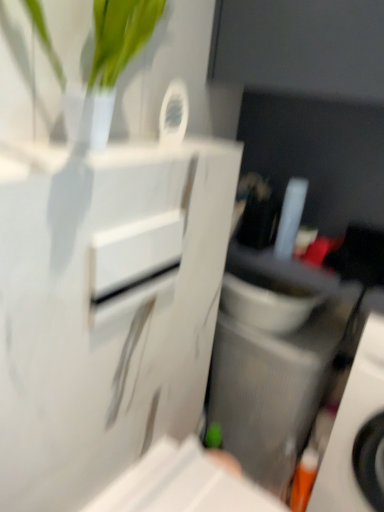
What are the coordinates of `gray textured speaker at lower right` in the screenshot? It's located at (270, 391).

You are a GUI agent. You are given a task and a screenshot of the screen. Output one action in this format:
    pyautogui.click(x=<x>, y=<y>)
    Task: Click on the orange plastic toothbrush at lower right
    The height and width of the screenshot is (512, 384).
    Given the screenshot: What is the action you would take?
    pyautogui.click(x=357, y=434)

Locate an element on the screen. white glossy drawer at center is located at coordinates (134, 254).

From the image's perspective, who appears lower, gray textured speaker at lower right or orange plastic toothbrush at lower right?

From the image's view, orange plastic toothbrush at lower right is below.

Is gray textured speaker at lower right wider than orange plastic toothbrush at lower right?

No.

Are gray textured speaker at lower right and orange plastic toothbrush at lower right beside each other?

No, gray textured speaker at lower right is not touching orange plastic toothbrush at lower right.

Can you tell me how much white glossy drawer at center and orange plastic toothbrush at lower right differ in facing direction?

white glossy drawer at center and orange plastic toothbrush at lower right are facing 91.4 degrees away from each other.

Identify the location of home appliance located behind the white glossy drawer at center. The height and width of the screenshot is (512, 384). (357, 434).

In the scene shown: Considering the relative positions of white glossy drawer at center and orange plastic toothbrush at lower right in the image provided, is white glossy drawer at center behind orange plastic toothbrush at lower right?

No, the depth of white glossy drawer at center is less than that of orange plastic toothbrush at lower right.

From the image's perspective, who appears lower, white glossy drawer at center or gray textured speaker at lower right?

From the image's view, gray textured speaker at lower right is below.

Is point (171, 253) closer to camera compared to point (226, 449)?

Yes, point (171, 253) is in front of point (226, 449).

From a real-world perspective, is white glossy drawer at center on top of gray textured speaker at lower right?

Yes, from a real-world perspective, white glossy drawer at center is on top of gray textured speaker at lower right.

Does white glossy drawer at center contain gray textured speaker at lower right?

That's incorrect, gray textured speaker at lower right is not inside white glossy drawer at center.

Find the location of a particular element. appliance lying above the orange plastic toothbrush at lower right (from the image's perspective) is located at coordinates (270, 391).

Is orange plastic toothbrush at lower right to the left or to the right of gray textured speaker at lower right in the image?

orange plastic toothbrush at lower right is to the right of gray textured speaker at lower right.

From the image's perspective, which one is positioned higher, orange plastic toothbrush at lower right or gray textured speaker at lower right?

gray textured speaker at lower right.

Is orange plastic toothbrush at lower right not within gray textured speaker at lower right?

orange plastic toothbrush at lower right lies outside gray textured speaker at lower right's area.

Where is `drawer that is on the left side of orange plastic toothbrush at lower right`? drawer that is on the left side of orange plastic toothbrush at lower right is located at coordinates (134, 254).

Are orange plastic toothbrush at lower right and white glossy drawer at center located far from each other?

orange plastic toothbrush at lower right is actually quite close to white glossy drawer at center.

Does point (340, 484) lie in front of point (125, 228)?

That is False.

Does orange plastic toothbrush at lower right have a lesser width compared to white glossy drawer at center?

Incorrect, the width of orange plastic toothbrush at lower right is not less than that of white glossy drawer at center.

Between gray textured speaker at lower right and white glossy drawer at center, which one has more height?

gray textured speaker at lower right.

From the image's perspective, is gray textured speaker at lower right located above white glossy drawer at center?

No, from the image's perspective, gray textured speaker at lower right is not above white glossy drawer at center.

Can you see gray textured speaker at lower right touching white glossy drawer at center?

No, gray textured speaker at lower right is not beside white glossy drawer at center.

This screenshot has width=384, height=512. In order to click on home appliance located on the right of gray textured speaker at lower right in this screenshot , I will do `click(357, 434)`.

Locate an element on the screen. Image resolution: width=384 pixels, height=512 pixels. home appliance that is behind the white glossy drawer at center is located at coordinates pyautogui.click(x=357, y=434).

Which object lies nearer to the anchor point white glossy drawer at center, orange plastic toothbrush at lower right or gray textured speaker at lower right?

orange plastic toothbrush at lower right is closer to white glossy drawer at center.

Considering their positions, is white glossy drawer at center positioned closer to orange plastic toothbrush at lower right than gray textured speaker at lower right?

gray textured speaker at lower right lies closer to orange plastic toothbrush at lower right than the other object.

Based on their spatial positions, is gray textured speaker at lower right or white glossy drawer at center closer to orange plastic toothbrush at lower right?

gray textured speaker at lower right is closer to orange plastic toothbrush at lower right.

When comparing their distances from gray textured speaker at lower right, does white glossy drawer at center or orange plastic toothbrush at lower right seem further?

Based on the image, white glossy drawer at center appears to be further to gray textured speaker at lower right.

Estimate the real-world distances between objects in this image. Which object is further from gray textured speaker at lower right, orange plastic toothbrush at lower right or white glossy drawer at center?

white glossy drawer at center is positioned further to the anchor gray textured speaker at lower right.

Which object lies further to the anchor point white glossy drawer at center, gray textured speaker at lower right or orange plastic toothbrush at lower right?

gray textured speaker at lower right is further to white glossy drawer at center.

At what (x,y) coordinates should I click in order to perform the action: click on appliance located between white glossy drawer at center and orange plastic toothbrush at lower right in the left-right direction. Please return your answer as a coordinate pair (x, y). The width and height of the screenshot is (384, 512). Looking at the image, I should click on (270, 391).